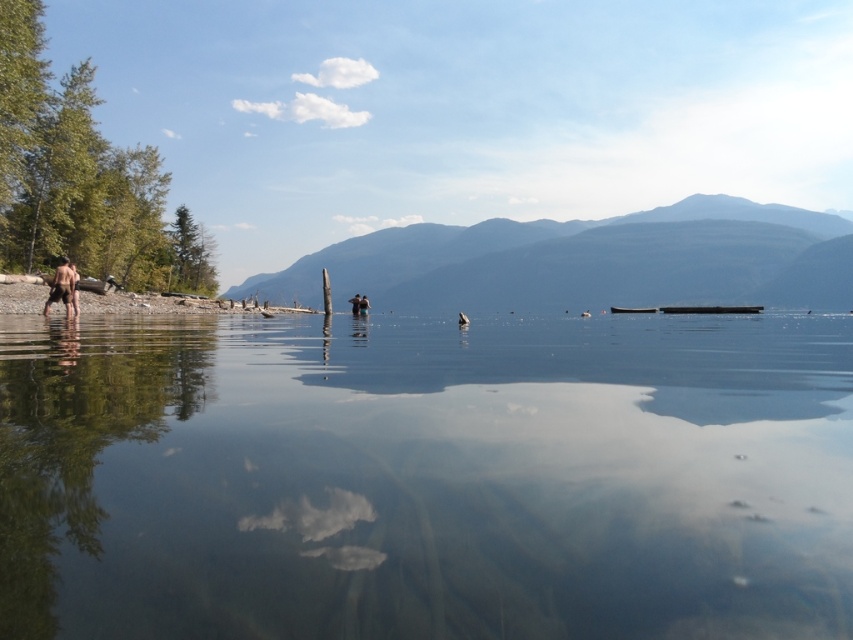
You are a photographer planning to capture the reflection of the clear water at center and the brown skin at left in this lakeside scene. Since the camera can only focus on one object at a time, which object should you choose to ensure the reflection is most prominent in the photo?

The clear water at center is bigger than brown skin at left, so the reflection of the clear water at center will be more prominent in the photo.

You are a photographer standing at the lakeside. You want to capture a photo that includes both the clear water at center and the brown skin at left. Which object should you focus on first to ensure both are in sharp focus?

The clear water at center is in front of the brown skin at left, so you should focus on the clear water at center first to ensure both are in sharp focus.

You are a photographer standing at the lakeside and want to take a photo that includes both the brown wood at left and the smooth skin person at center. Based on their positions, which object is closer to the left edge of the photo?

The brown wood at left is positioned on the left side of smooth skin person at center, so the brown wood at left is closer to the left edge of the photo.